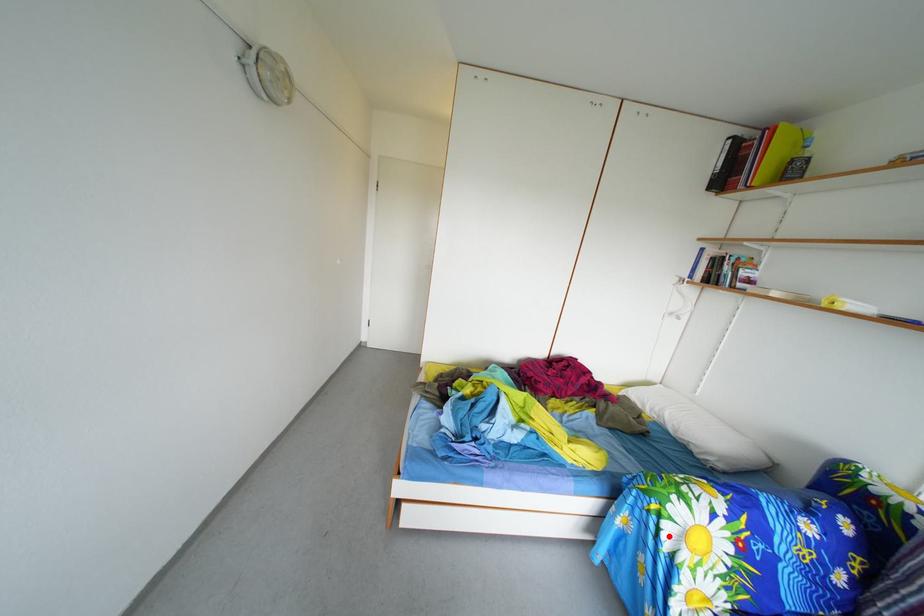
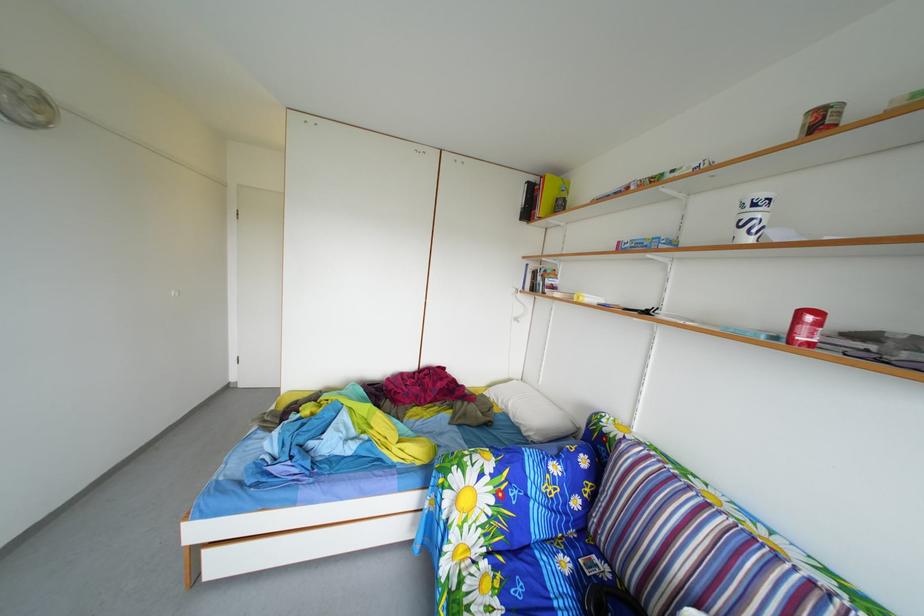
The point at the highlighted location is marked in the first image. Where is the corresponding point in the second image?

(453, 507)